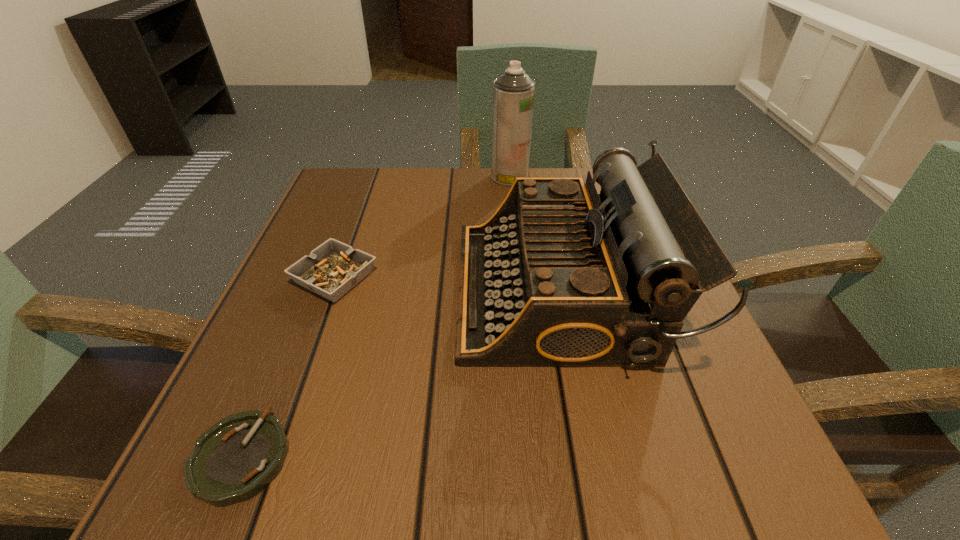
This screenshot has height=540, width=960. I want to click on blank area located 0.210m on the keyboard of the second tallest object, so click(342, 291).

The image size is (960, 540). In order to click on free space located 0.220m on the right of the taller ashtray in this screenshot , I will do `click(496, 278)`.

The width and height of the screenshot is (960, 540). In order to click on vacant region located on the back of the nearer ashtray in this screenshot , I will do `click(304, 305)`.

The image size is (960, 540). In order to click on object that is at the far edge in this screenshot , I will do `click(513, 92)`.

Locate an element on the screen. This screenshot has height=540, width=960. object that is at the near edge is located at coordinates (236, 458).

This screenshot has width=960, height=540. Identify the location of object that is at the right edge. (559, 276).

Locate an element on the screen. object situated at the near left corner is located at coordinates (236, 458).

Where is `vacant space at the far edge of the desktop`? Image resolution: width=960 pixels, height=540 pixels. vacant space at the far edge of the desktop is located at coordinates click(444, 198).

I want to click on vacant area at the near edge, so click(x=394, y=474).

The height and width of the screenshot is (540, 960). In the image, there is a desktop. What are the coordinates of `blank space at the left edge` in the screenshot? It's located at (375, 243).